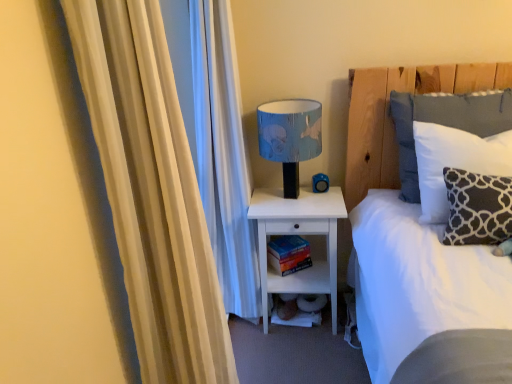
Question: Which is correct: white cotton pillow at upper right, which is the second pillow from front to back, is inside white soft bed at upper right, or outside of it?

Choices:
 (A) inside
 (B) outside

Answer: (A)

Question: Is white cotton pillow at upper right, which is the second pillow from front to back, taller or shorter than white soft bed at upper right?

Choices:
 (A) tall
 (B) short

Answer: (B)

Question: Which of these objects is positioned farthest from the blue fabric lampshade at upper center?

Choices:
 (A) white soft bed at upper right
 (B) beige fabric curtain at left
 (C) white cotton pillow at upper right, which is the second pillow from front to back
 (D) dark gray fabric pillow at right, the 1th pillow viewed from the front
 (E) hardcover book at lower center

Answer: (B)

Question: Which of these objects is positioned closest to the blue fabric lampshade at upper center?

Choices:
 (A) white matte nightstand at lower center
 (B) white soft bed at upper right
 (C) hardcover book at lower center
 (D) white cotton pillow at upper right, marked as the first pillow in a back-to-front arrangement
 (E) dark gray fabric pillow at right, which is the 2th pillow from back to front

Answer: (A)